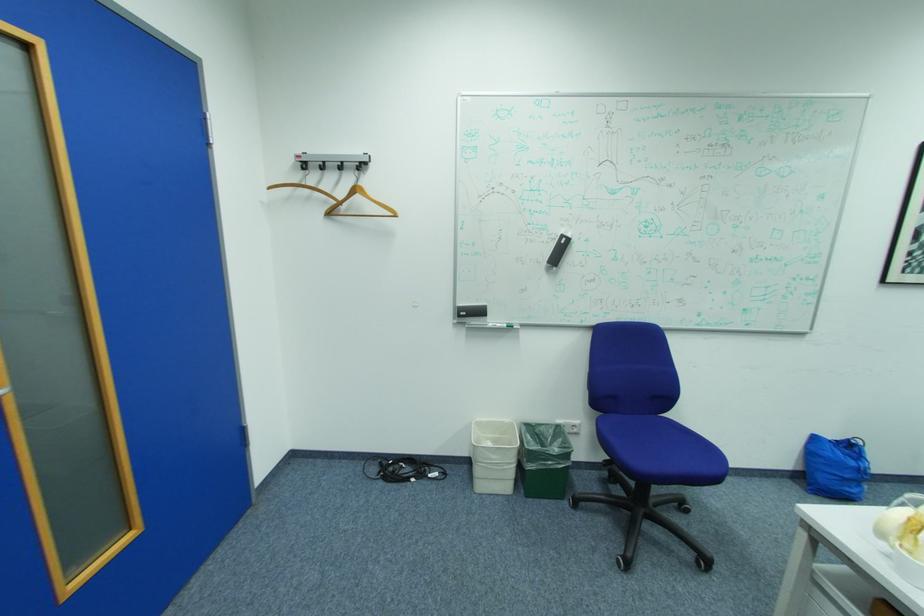
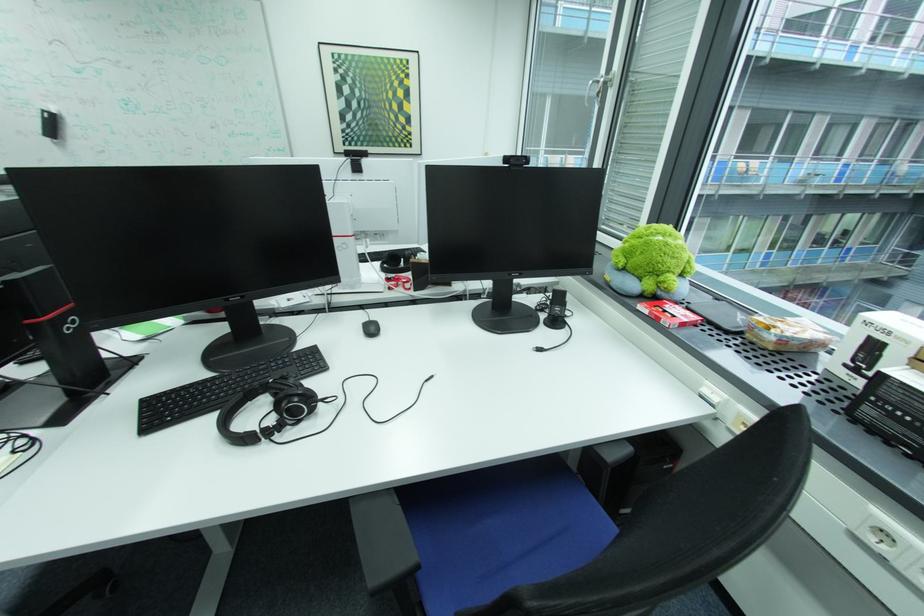
Where in the second image is the point corresponding to point (892, 283) from the first image?

(344, 153)